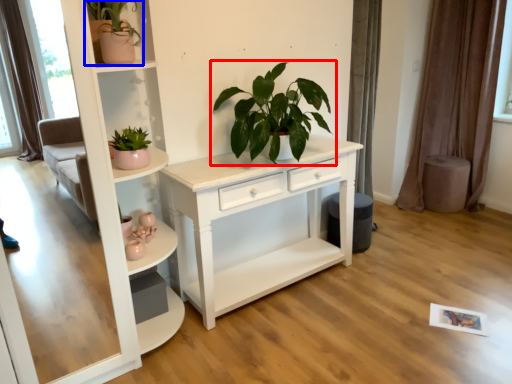
Question: Which object appears farthest to the camera in this image, houseplant (highlighted by a red box) or houseplant (highlighted by a blue box)?

Choices:
 (A) houseplant
 (B) houseplant

Answer: (A)